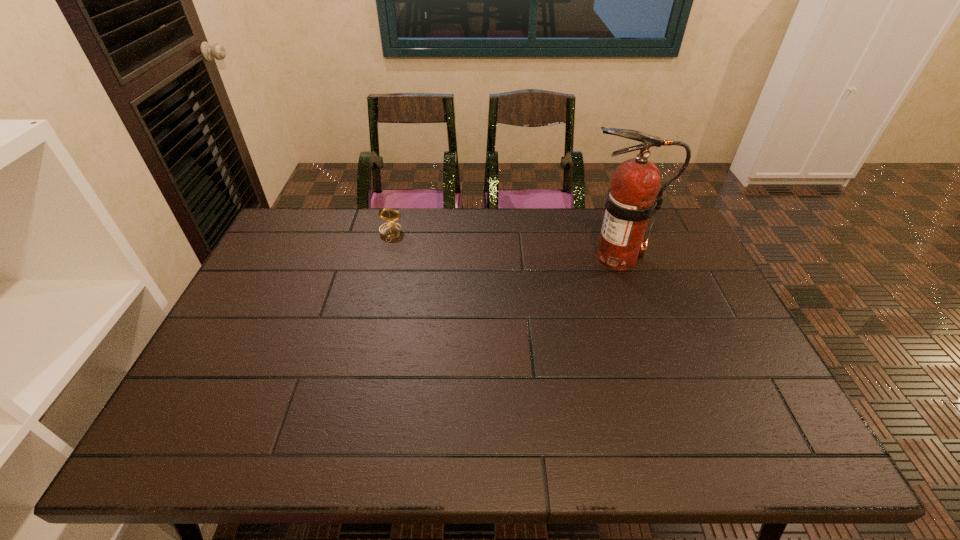
Locate an element on the screen. object that is at the right edge is located at coordinates (632, 200).

This screenshot has width=960, height=540. What are the coordinates of `object that is positioned at the far right corner` in the screenshot? It's located at (632, 200).

In the image, there is a desktop. Find the location of `vacant space at the far edge`. vacant space at the far edge is located at coordinates (374, 213).

The image size is (960, 540). In the image, there is a desktop. Identify the location of vacant area at the near edge. (640, 456).

This screenshot has width=960, height=540. In the image, there is a desktop. What are the coordinates of `vacant space at the left edge` in the screenshot? It's located at (262, 264).

In the image, there is a desktop. Where is `vacant area at the far left corner`? This screenshot has height=540, width=960. vacant area at the far left corner is located at coordinates (284, 230).